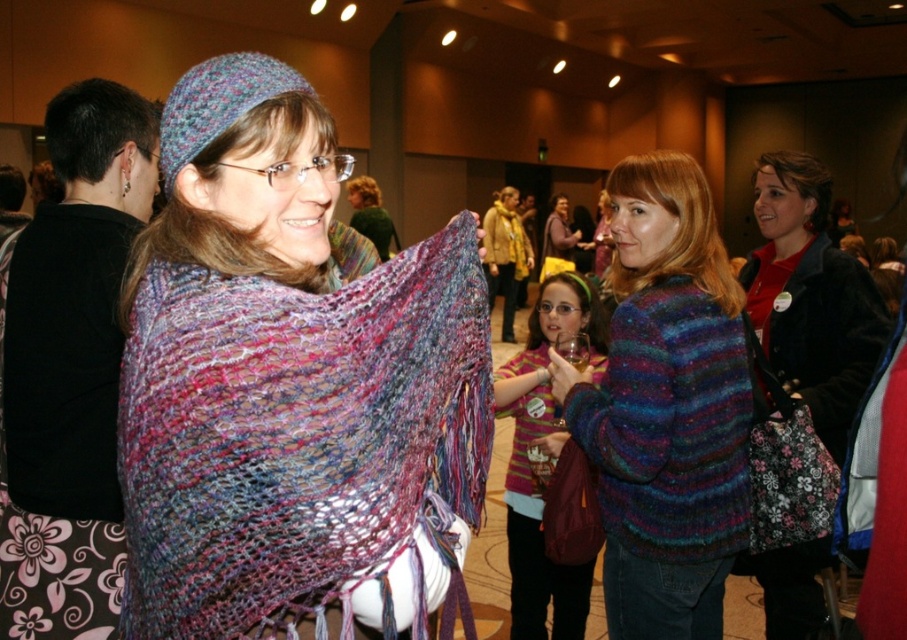
Who is more forward, (691, 484) or (515, 545)?

Point (691, 484) is in front.

Who is lower down, multicolored knitted sweater at center or striped sweater at center?

Positioned lower is striped sweater at center.

Find the location of a particular element. The height and width of the screenshot is (640, 907). multicolored knitted sweater at center is located at coordinates pos(666,406).

You are a GUI agent. You are given a task and a screenshot of the screen. Output one action in this format:
    pyautogui.click(x=<x>, y=<y>)
    Task: Click on the multicolored knitted sweater at center
    
    Given the screenshot: What is the action you would take?
    pyautogui.click(x=666, y=406)

Identify the location of multicolored knitted shawl at left. The height and width of the screenshot is (640, 907). (289, 385).

How distant is multicolored knitted shawl at left from striped sweater at center?

multicolored knitted shawl at left is 4.36 feet away from striped sweater at center.

Does point (158, 524) come farther from viewer compared to point (569, 596)?

No.

This screenshot has width=907, height=640. What are the coordinates of `multicolored knitted shawl at left` in the screenshot? It's located at (289, 385).

Is multicolored knitted sweater at center behind velvet red coat at center?

No.

The width and height of the screenshot is (907, 640). I want to click on multicolored knitted sweater at center, so click(x=666, y=406).

Is point (665, 371) farther from camera compared to point (825, 241)?

That is False.

At what (x,y) coordinates should I click in order to perform the action: click on multicolored knitted sweater at center. Please return your answer as a coordinate pair (x, y). The image size is (907, 640). Looking at the image, I should click on (666, 406).